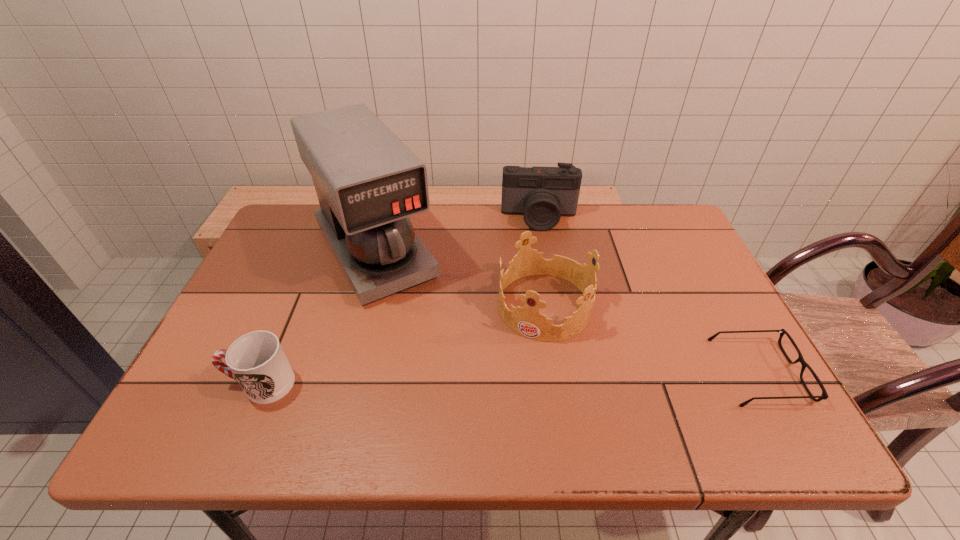
Where is `vacant space located at the lens of the camera`? vacant space located at the lens of the camera is located at coordinates (540, 251).

Where is `vacant point located at the lens of the camera`? This screenshot has height=540, width=960. vacant point located at the lens of the camera is located at coordinates (544, 311).

The width and height of the screenshot is (960, 540). Identify the location of free space located at the lens of the camera. (544, 302).

In order to click on coffee maker at the far edge in this screenshot , I will do `click(368, 182)`.

Find the location of a particular element. This screenshot has height=540, width=960. camera present at the far edge is located at coordinates (542, 195).

You are a GUI agent. You are given a task and a screenshot of the screen. Output one action in this format:
    pyautogui.click(x=<x>, y=<y>)
    Task: Click on the cup situated at the near edge
    This screenshot has height=540, width=960.
    Given the screenshot: What is the action you would take?
    pyautogui.click(x=256, y=360)

Where is `spectacles that is at the near edge`? The width and height of the screenshot is (960, 540). spectacles that is at the near edge is located at coordinates (824, 396).

Locate an element on the screen. cup present at the left edge is located at coordinates (256, 360).

What are the coordinates of `coffee maker that is positioned at the left edge` in the screenshot? It's located at (368, 182).

At what (x,y) coordinates should I click in order to perform the action: click on object that is at the right edge. Please return your answer as a coordinate pair (x, y). Looking at the image, I should click on (824, 396).